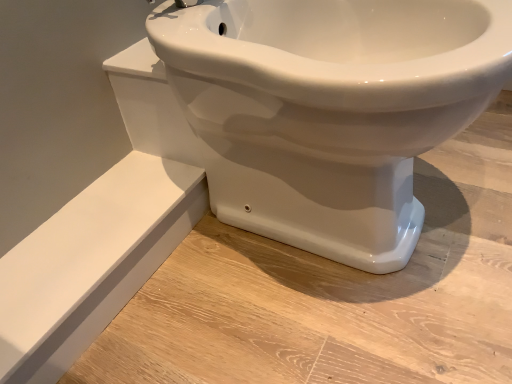
At what (x,y) coordinates should I click in order to perform the action: click on vacant region below white glossy toilet at center (from a real-world perspective). Please return your answer as a coordinate pair (x, y). Looking at the image, I should click on (332, 253).